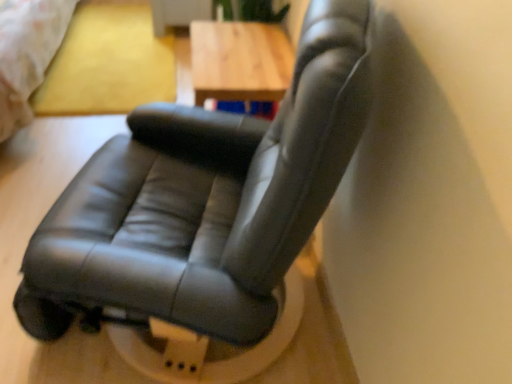
Question: Is wooden table at center to the left of black leather chair at center from the viewer's perspective?

Choices:
 (A) no
 (B) yes

Answer: (A)

Question: Is wooden table at center positioned in front of black leather chair at center?

Choices:
 (A) no
 (B) yes

Answer: (A)

Question: Is the depth of wooden table at center greater than that of black leather chair at center?

Choices:
 (A) yes
 (B) no

Answer: (A)

Question: Can black leather chair at center be found inside wooden table at center?

Choices:
 (A) yes
 (B) no

Answer: (B)

Question: From a real-world perspective, is wooden table at center located beneath black leather chair at center?

Choices:
 (A) no
 (B) yes

Answer: (A)

Question: Could you tell me if wooden table at center is turned towards black leather chair at center?

Choices:
 (A) yes
 (B) no

Answer: (A)

Question: Is black leather chair at center at the left side of matte yellow bed at upper left?

Choices:
 (A) no
 (B) yes

Answer: (A)

Question: Does black leather chair at center come in front of matte yellow bed at upper left?

Choices:
 (A) yes
 (B) no

Answer: (A)

Question: Can you confirm if black leather chair at center is bigger than matte yellow bed at upper left?

Choices:
 (A) yes
 (B) no

Answer: (B)

Question: Is black leather chair at center with matte yellow bed at upper left?

Choices:
 (A) no
 (B) yes

Answer: (A)

Question: Does black leather chair at center turn towards matte yellow bed at upper left?

Choices:
 (A) yes
 (B) no

Answer: (B)

Question: From a real-world perspective, is black leather chair at center on top of matte yellow bed at upper left?

Choices:
 (A) no
 (B) yes

Answer: (A)

Question: Are black leather chair at center and wooden table at center far apart?

Choices:
 (A) yes
 (B) no

Answer: (B)